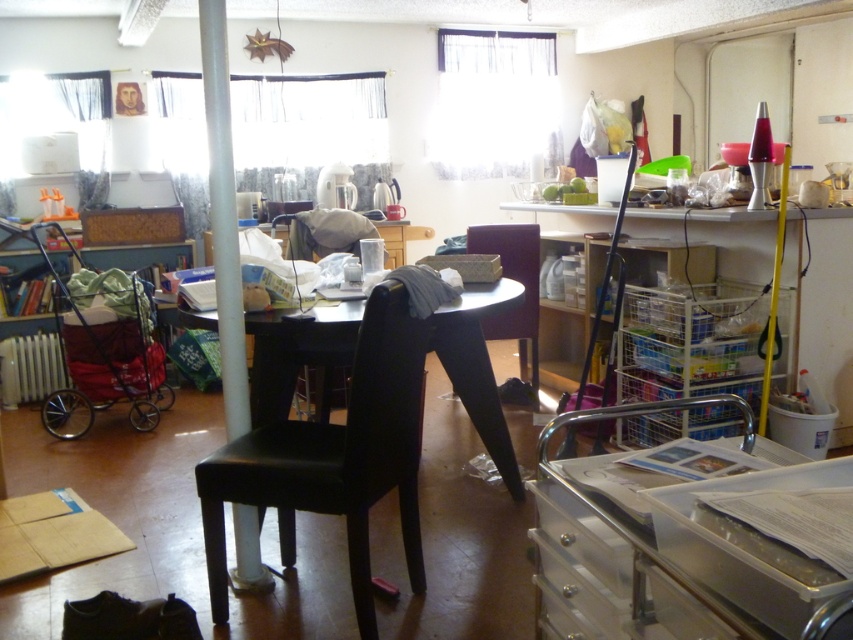
You are organizing the dining area and need to determine seating arrangements. Which object, the black leather chair at center or the black leather table at center, can accommodate more people?

The black leather table at center is larger in size than the black leather chair at center, so it can accommodate more people.

You are organizing the dining area and need to move the black leather chair at center and the matte black chair at center closer together. Which chair should you move to the right to make them closer?

The black leather chair at center is positioned on the left side of matte black chair at center. To move them closer, you should move the black leather chair at center to the right towards the matte black chair at center.

You are trying to decide whether to sit on the black leather chair at center or the black leather table at center. Which one is taller?

The black leather chair at center is much taller than the black leather table at center, so it is better to sit on the chair.